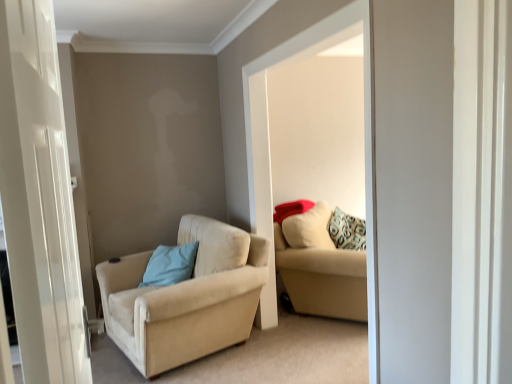
At what (x,y) coordinates should I click in order to perform the action: click on light blue fabric pillow at center-left. Please return your answer as a coordinate pair (x, y). The height and width of the screenshot is (384, 512). Looking at the image, I should click on (170, 265).

What is the approximate width of light blue fabric pillow at center-left?

13.90 inches.

From the picture: Measure the distance between point (x=362, y=272) and camera.

A distance of 10.57 feet exists between point (x=362, y=272) and camera.

At what (x,y) coordinates should I click in order to perform the action: click on light blue fabric pillow at center-left. Please return your answer as a coordinate pair (x, y). The width and height of the screenshot is (512, 384). Looking at the image, I should click on (170, 265).

Considering the sizes of objects light blue fabric pillow at center-left and beige fabric couch at center in the image provided, who is bigger, light blue fabric pillow at center-left or beige fabric couch at center?

beige fabric couch at center is bigger.

Is light blue fabric pillow at center-left inside the boundaries of beige fabric couch at center, or outside?

light blue fabric pillow at center-left is not inside beige fabric couch at center, it's outside.

Identify the location of pillow below the beige fabric couch at center (from the image's perspective). (170, 265).

Where is `door located above the light blue fabric pillow at center-left (from the image's perspective)`? door located above the light blue fabric pillow at center-left (from the image's perspective) is located at coordinates (39, 199).

In terms of height, does white glossy door at left look taller or shorter compared to light blue fabric pillow at center-left?

Clearly, white glossy door at left is taller compared to light blue fabric pillow at center-left.

From a real-world perspective, is white glossy door at left above or below light blue fabric pillow at center-left?

From a real-world perspective, white glossy door at left is physically above light blue fabric pillow at center-left.

Is beige fabric couch at center surrounded by white glossy door at left?

Definitely not — beige fabric couch at center is not inside white glossy door at left.

Is white glossy door at left bigger than beige fabric couch at center?

No.

Where is `window on the right of white glossy door at left`? This screenshot has width=512, height=384. window on the right of white glossy door at left is located at coordinates (267, 105).

Is point (53, 24) farther from viewer compared to point (245, 133)?

No, it is in front of (245, 133).

Who is bigger, white glossy door at left or beige fabric couch at center?

beige fabric couch at center.

Does white glossy door at left appear on the left side of beige fabric couch at center?

Yes, white glossy door at left is to the left of beige fabric couch at center.

Is white glossy door at left completely or partially outside of beige fabric couch at center?

Yes, white glossy door at left is outside of beige fabric couch at center.

Identify the location of door in front of the beige fabric couch at center. click(39, 199).

Considering the sizes of objects beige fabric couch at center and white glossy door at left in the image provided, who is bigger, beige fabric couch at center or white glossy door at left?

beige fabric couch at center.

Is beige fabric couch at center facing away from white glossy door at left?

No, beige fabric couch at center's orientation is not away from white glossy door at left.

Does beige fabric couch at center lie behind white glossy door at left?

Yes, beige fabric couch at center is further from the viewer.

From the image's perspective, which is below, beige fabric couch at center or white glossy door at left?

beige fabric couch at center, from the image's perspective.

From the image's perspective, is beige fabric couch at center below beige fabric chair at left?

Actually, beige fabric couch at center appears above beige fabric chair at left in the image.

How many degrees apart are the facing directions of beige fabric couch at center and beige fabric chair at left?

15.8 degrees.

In terms of size, does beige fabric couch at center appear bigger or smaller than beige fabric chair at left?

Considering their sizes, beige fabric couch at center takes up less space than beige fabric chair at left.

Is beige fabric chair at left a part of beige fabric couch at center?

Definitely not — beige fabric chair at left is not inside beige fabric couch at center.

Is beige fabric chair at left inside or outside of beige fabric couch at center?

beige fabric chair at left is spatially situated outside beige fabric couch at center.

Identify the location of studio couch that appears above the beige fabric chair at left (from the image's perspective). (320, 267).

From the image's perspective, is beige fabric chair at left on top of beige fabric couch at center?

Incorrect, from the image's perspective, beige fabric chair at left is lower than beige fabric couch at center.

Considering the positions of points (196, 333) and (293, 294), is point (196, 333) closer to camera compared to point (293, 294)?

That is True.

Find the location of a particular element. Image resolution: width=512 pixels, height=384 pixels. pillow to the left of beige fabric couch at center is located at coordinates tap(170, 265).

The height and width of the screenshot is (384, 512). In the image, there is a white glossy door at left. What are the coordinates of `pillow below it (from the image's perspective)` in the screenshot? It's located at (170, 265).

From the image, which object appears to be nearer to beige fabric chair at left, light blue fabric pillow at center-left or beige fabric couch at center?

light blue fabric pillow at center-left is positioned closer to the anchor beige fabric chair at left.

Considering their positions, is beige fabric couch at center positioned further to beige fabric couch at center than light blue fabric pillow at center-left?

The object further to beige fabric couch at center is light blue fabric pillow at center-left.

Which object lies further to the anchor point light blue fabric pillow at center-left, beige fabric chair at left or beige fabric couch at center?

Based on the image, beige fabric couch at center appears to be further to light blue fabric pillow at center-left.

Based on their spatial positions, is beige fabric chair at left or light blue fabric pillow at center-left closer to beige fabric couch at center?

The object closer to beige fabric couch at center is beige fabric chair at left.

Which object lies further to the anchor point beige fabric couch at center, light blue fabric pillow at center-left or beige fabric chair at left?

light blue fabric pillow at center-left lies further to beige fabric couch at center than the other object.

Considering their positions, is beige fabric couch at center positioned further to beige fabric chair at left than beige fabric couch at center?

beige fabric couch at center is further to beige fabric chair at left.

Based on their spatial positions, is beige fabric couch at center or white glossy door at left closer to light blue fabric pillow at center-left?

The object closer to light blue fabric pillow at center-left is beige fabric couch at center.

Based on their spatial positions, is beige fabric chair at left or white glossy door at left closer to beige fabric couch at center?

The object closer to beige fabric couch at center is beige fabric chair at left.

The width and height of the screenshot is (512, 384). In order to click on studio couch positioned between white glossy door at left and light blue fabric pillow at center-left from near to far in this screenshot , I will do `click(320, 267)`.

Locate an element on the screen. The height and width of the screenshot is (384, 512). chair between white glossy door at left and beige fabric couch at center along the z-axis is located at coordinates (187, 298).

Where is `chair between beige fabric couch at center and beige fabric couch at center along the z-axis`? This screenshot has height=384, width=512. chair between beige fabric couch at center and beige fabric couch at center along the z-axis is located at coordinates (187, 298).

I want to click on chair located between light blue fabric pillow at center-left and beige fabric couch at center in the left-right direction, so click(187, 298).